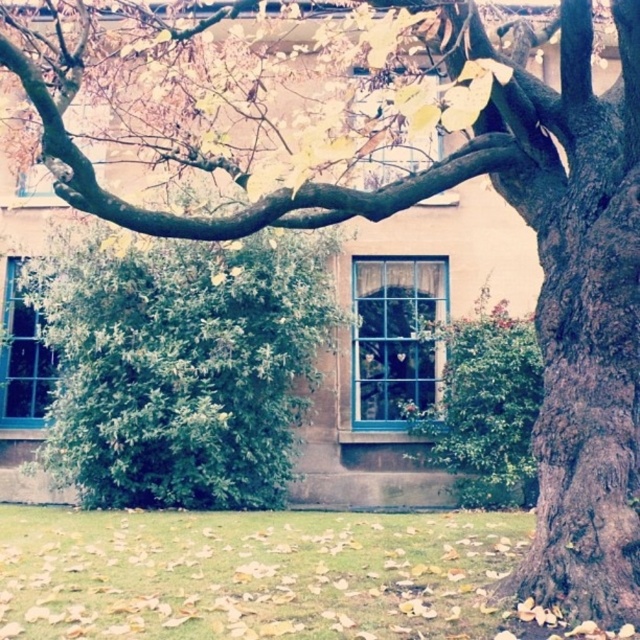
Question: Which object is the closest to the blue glass window at center left?

Choices:
 (A) blue glass window at center
 (B) green grass at lower center

Answer: (B)

Question: Which object is the farthest from the blue glass window at center?

Choices:
 (A) green grass at lower center
 (B) blue glass window at center left

Answer: (B)

Question: Is green grass at lower center above blue glass window at center left?

Choices:
 (A) no
 (B) yes

Answer: (A)

Question: Which object appears closest to the camera in this image?

Choices:
 (A) blue glass window at center
 (B) blue glass window at center left

Answer: (A)

Question: Is green grass at lower center below blue glass window at center left?

Choices:
 (A) no
 (B) yes

Answer: (B)

Question: Does green grass at lower center have a greater width compared to blue glass window at center?

Choices:
 (A) yes
 (B) no

Answer: (A)